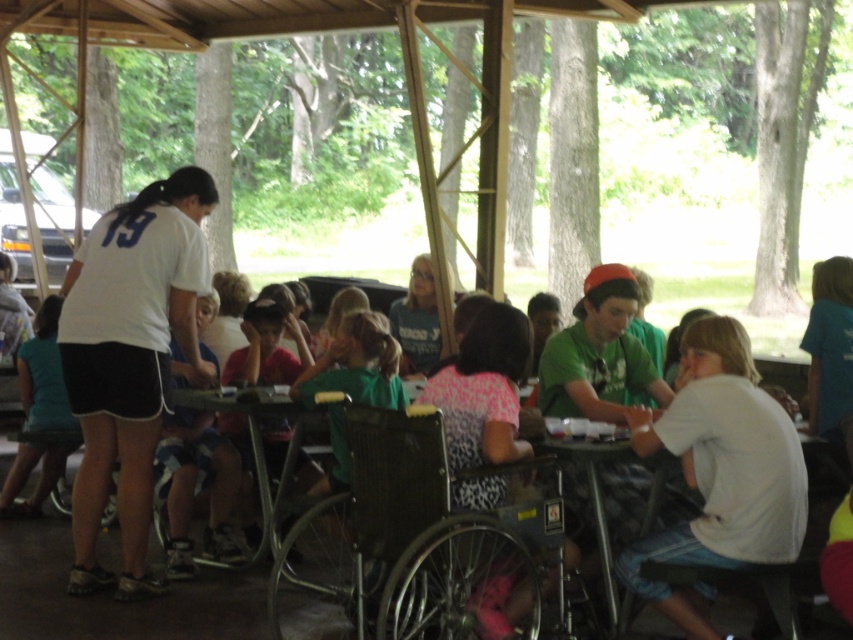
You are a photographer trying to capture a photo of the white matte shirt at center and the green plastic table at center. Since you want to focus on the shirt, which object should you position closer to the camera?

The white matte shirt at center has a greater height compared to the green plastic table at center, so positioning the white matte shirt at center closer to the camera will help emphasize its size in the photo.

From the picture: You are a photographer trying to capture a photo of the white matte shirt at center and the green plastic table at center. Which object should you focus on first if you want to ensure both are in sharp focus?

The white matte shirt at center has a larger size compared to the green plastic table at center, so you should focus on the white matte shirt at center first to ensure both are in sharp focus.

Consider the image. You are a visitor at the park and want to take a photo of the light blue shirt at left without including the metallic gray wheelchair at center in the frame. Is it possible to do so by adjusting your camera angle?

Yes, since the metallic gray wheelchair at center is below the light blue shirt at left, you can angle your camera upwards to capture the light blue shirt at left while avoiding the wheelchair in the lower area.